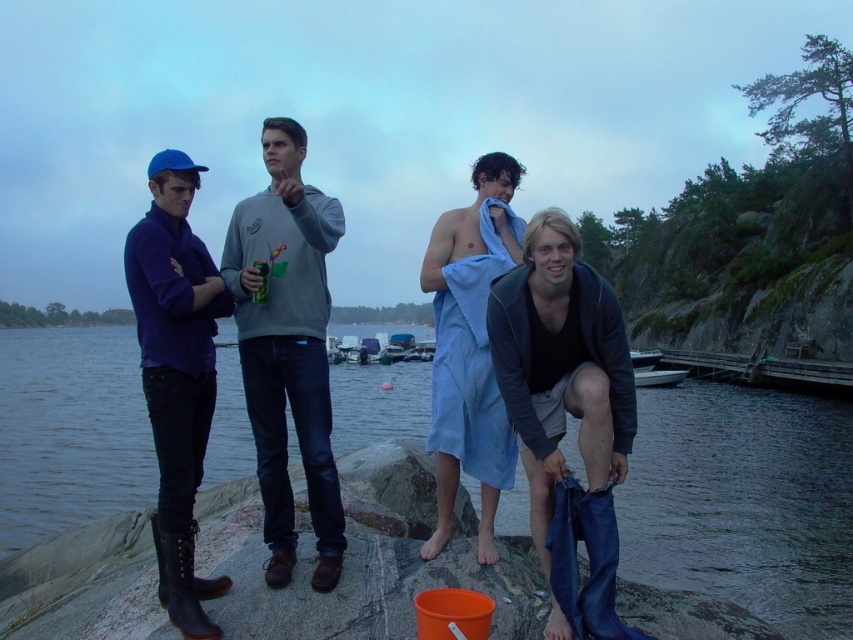
Can you confirm if transparent water at lower left is wider than dark blue denim shorts at lower right?

Correct, the width of transparent water at lower left exceeds that of dark blue denim shorts at lower right.

Which is above, transparent water at lower left or dark blue denim shorts at lower right?

dark blue denim shorts at lower right is above.

Identify the location of transparent water at lower left. Image resolution: width=853 pixels, height=640 pixels. (744, 500).

What are the coordinates of `transparent water at lower left` in the screenshot? It's located at (744, 500).

Is dark blue denim shorts at lower right positioned at the back of blue towel at lower right?

No, it is not.

From the picture: Can you confirm if dark blue denim shorts at lower right is positioned to the left of blue towel at lower right?

In fact, dark blue denim shorts at lower right is to the right of blue towel at lower right.

Is point (573, 225) less distant than point (590, 307)?

Yes, it is in front of point (590, 307).

Identify the location of dark blue denim shorts at lower right. The width and height of the screenshot is (853, 640). (560, 365).

Is matte blue sweater at left positioned at the back of blue towel at center?

No, matte blue sweater at left is closer to the viewer.

Does matte blue sweater at left lie in front of blue towel at center?

Yes, it is.

The image size is (853, 640). I want to click on matte blue sweater at left, so click(x=177, y=374).